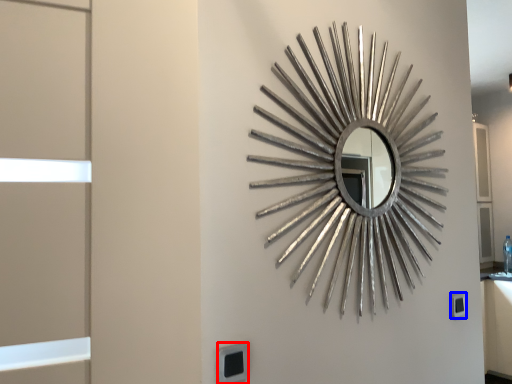
Question: Which of the following is the closest to the observer, electric outlet (highlighted by a red box) or electric outlet (highlighted by a blue box)?

Choices:
 (A) electric outlet
 (B) electric outlet

Answer: (A)